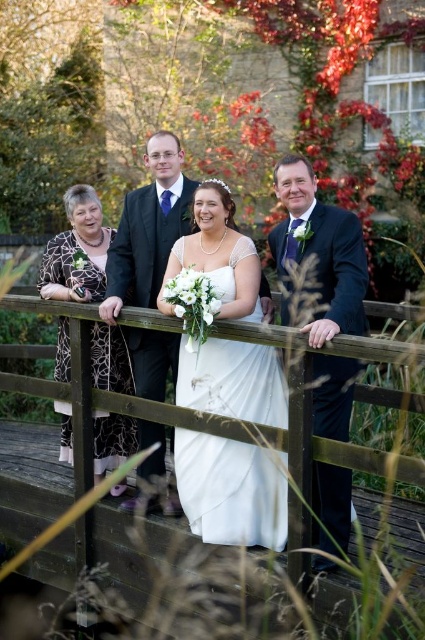
Question: Can you confirm if white satin dress at center is thinner than wooden at center?

Choices:
 (A) yes
 (B) no

Answer: (A)

Question: Which of the following is the farthest from the observer?

Choices:
 (A) (197, 529)
 (B) (414, 460)
 (C) (164, 460)
 (D) (311, 211)

Answer: (C)

Question: Which of these objects is positioned farthest from the matte black suit at center?

Choices:
 (A) wooden at center
 (B) white satin dress at center

Answer: (A)

Question: Among these points, which one is farthest from the camera?

Choices:
 (A) (331, 483)
 (B) (229, 349)

Answer: (B)

Question: Can you confirm if wooden at center is smaller than printed silk dress at left?

Choices:
 (A) no
 (B) yes

Answer: (A)

Question: Is white satin dress at center wider than wooden at center?

Choices:
 (A) yes
 (B) no

Answer: (B)